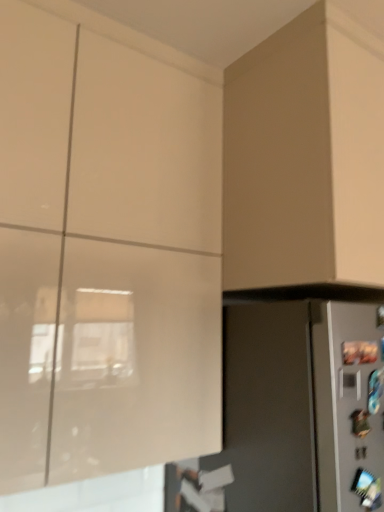
Question: Based on their positions, is matte gray refrigerator at lower right located to the left or right of matte beige cabinet at upper right, arranged as the second cabinetry when viewed from the left?

Choices:
 (A) right
 (B) left

Answer: (B)

Question: From their relative heights in the image, would you say matte gray refrigerator at lower right is taller or shorter than matte beige cabinet at upper right, acting as the 1th cabinetry starting from the right?

Choices:
 (A) tall
 (B) short

Answer: (A)

Question: Based on their relative distances, which object is farther from the matte gray refrigerator at lower right?

Choices:
 (A) matte beige cabinet at upper right, acting as the 1th cabinetry starting from the right
 (B) matte white cabinet at upper left, arranged as the 1th cabinetry when viewed from the left

Answer: (A)

Question: Estimate the real-world distances between objects in this image. Which object is farther from the matte white cabinet at upper left, which is counted as the 2th cabinetry, starting from the right?

Choices:
 (A) matte beige cabinet at upper right, arranged as the second cabinetry when viewed from the left
 (B) matte gray refrigerator at lower right

Answer: (A)